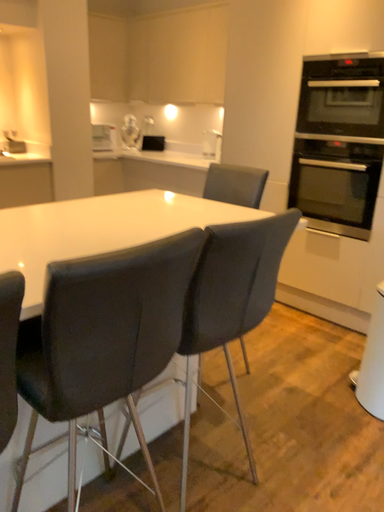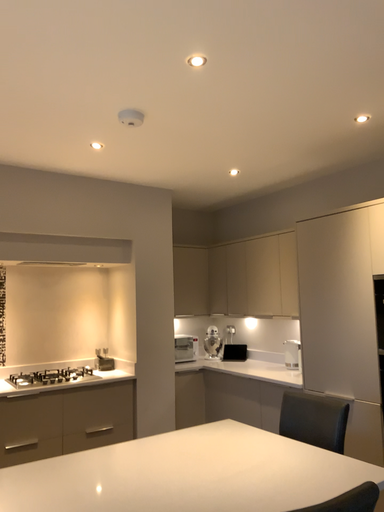
Question: How did the camera likely rotate when shooting the video?

Choices:
 (A) rotated downward
 (B) rotated upward

Answer: (B)